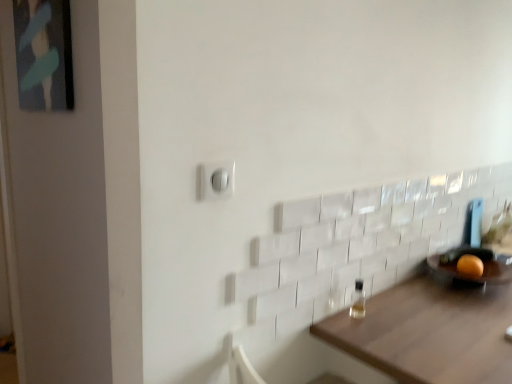
The image size is (512, 384). In order to click on free space to the left of orange matte at right in this screenshot , I will do `click(444, 277)`.